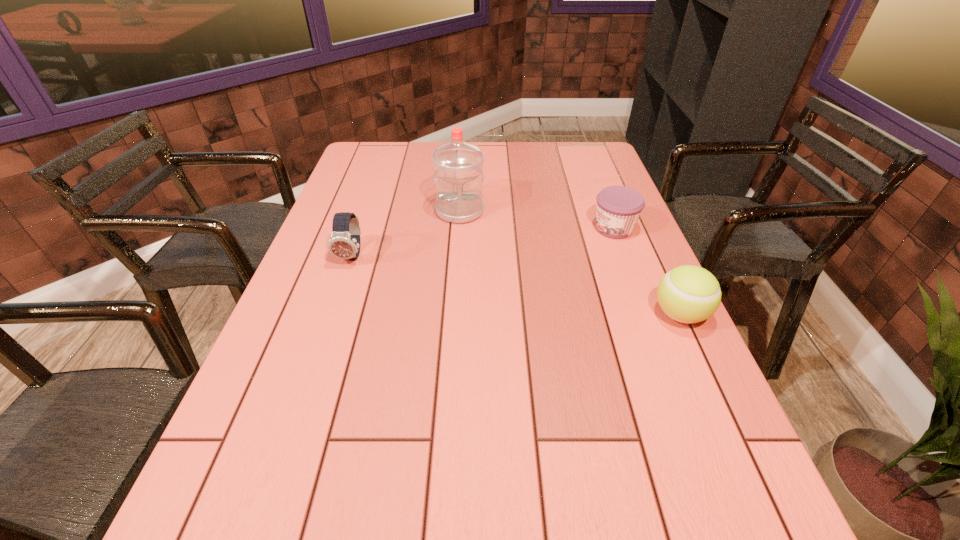
This screenshot has width=960, height=540. In the image, there is a desktop. In order to click on blank space at the far left corner in this screenshot , I will do `click(377, 146)`.

In the image, there is a desktop. Where is `free space at the near left corner`? This screenshot has width=960, height=540. free space at the near left corner is located at coordinates (228, 447).

Find the location of `free space at the far right corner of the desktop`. free space at the far right corner of the desktop is located at coordinates point(605,156).

The width and height of the screenshot is (960, 540). What are the coordinates of `unoccupied area between the water bottle and the tennis ball` in the screenshot? It's located at (569, 263).

Identify the location of unoccupied area between the tennis ball and the water bottle. (569, 263).

The height and width of the screenshot is (540, 960). I want to click on free space between the second nearest object and the nearest object, so click(516, 285).

Locate an element on the screen. Image resolution: width=960 pixels, height=540 pixels. vacant point located between the jam and the tallest object is located at coordinates (537, 220).

Image resolution: width=960 pixels, height=540 pixels. I want to click on empty space between the leftmost object and the jam, so click(483, 242).

Where is `free area in between the water bottle and the shortest object`? This screenshot has width=960, height=540. free area in between the water bottle and the shortest object is located at coordinates (537, 220).

This screenshot has width=960, height=540. I want to click on free space between the jam and the water bottle, so click(537, 220).